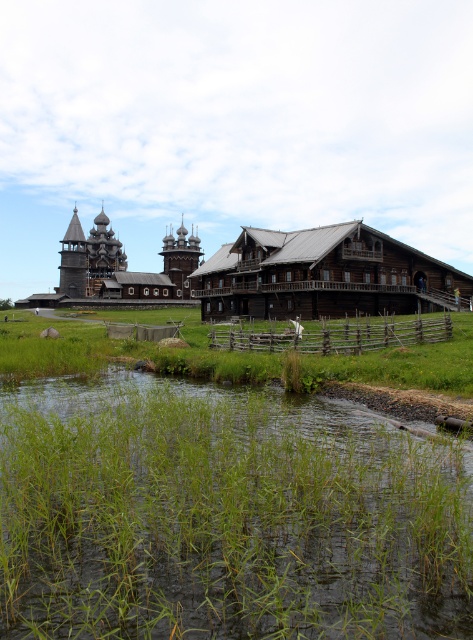
Which of these two, green grass at lower center or brown wooden fence at center, stands shorter?

Standing shorter between the two is brown wooden fence at center.

Which is above, green grass at lower center or brown wooden fence at center?

brown wooden fence at center is above.

Image resolution: width=473 pixels, height=640 pixels. What are the coordinates of `green grass at lower center` in the screenshot? It's located at (225, 516).